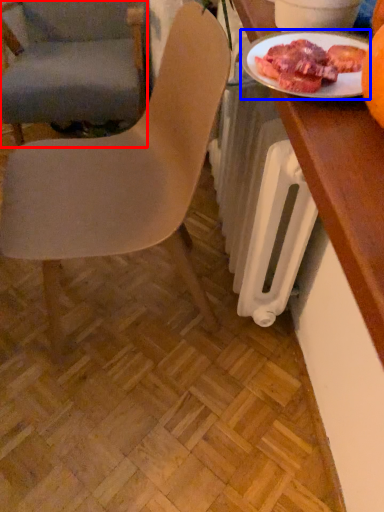
Question: Which object appears closest to the camera in this image, chair (highlighted by a red box) or tableware (highlighted by a blue box)?

Choices:
 (A) chair
 (B) tableware

Answer: (B)